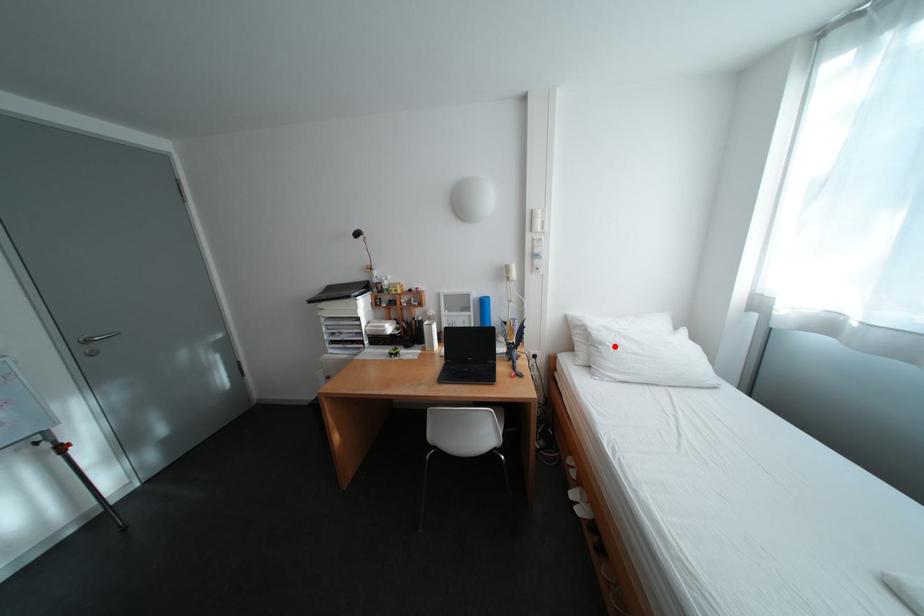
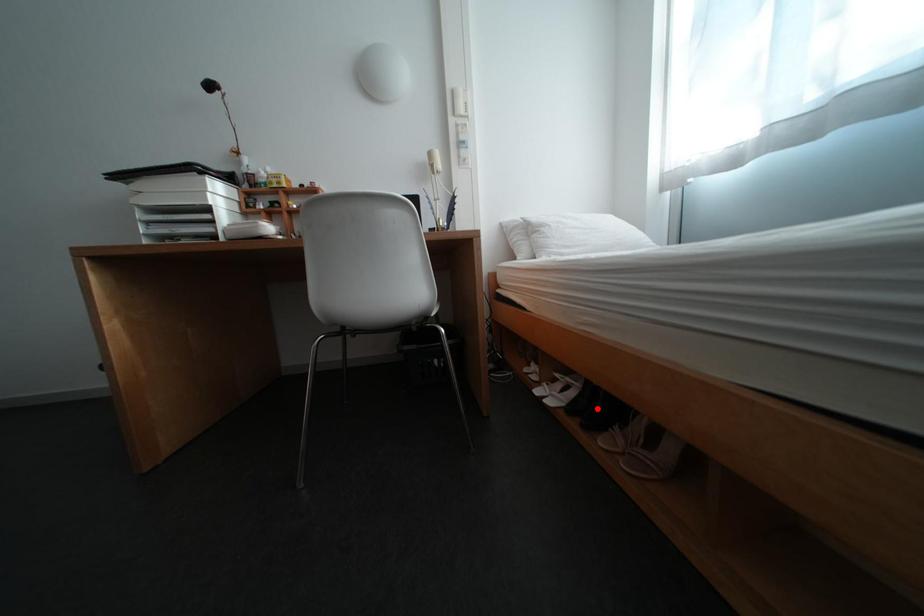
I am providing you with two images of the same scene from different viewpoints. A red point is marked on the first image and another point is marked on the second image. Is the red point in image1 aligned with the point shown in image2?

No